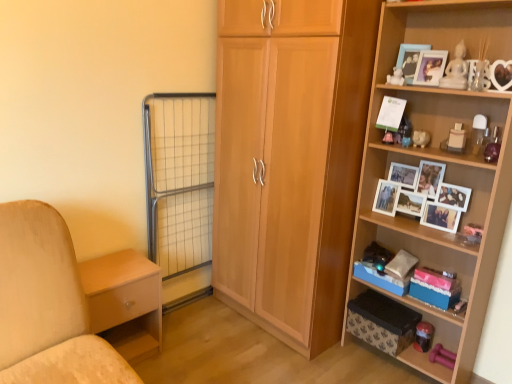
Identify the location of vacant region to the left of light brown wood cupboard at center. The width and height of the screenshot is (512, 384). (201, 332).